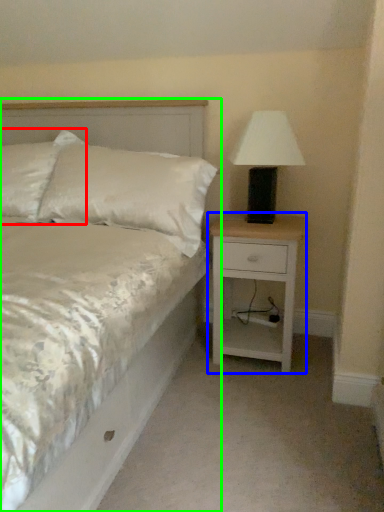
Question: Which object is the farthest from pillow (highlighted by a red box)? Choose among these: nightstand (highlighted by a blue box) or bed (highlighted by a green box).

Choices:
 (A) nightstand
 (B) bed

Answer: (A)